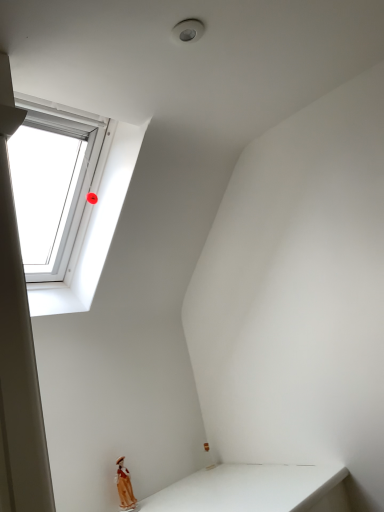
Find the location of a particular element. The image size is (384, 512). white plastic window at upper left is located at coordinates coord(83,205).

What do you see at coordinates (83, 205) in the screenshot? I see `white plastic window at upper left` at bounding box center [83, 205].

What are the coordinates of `white plastic window at upper left` in the screenshot? It's located at (83, 205).